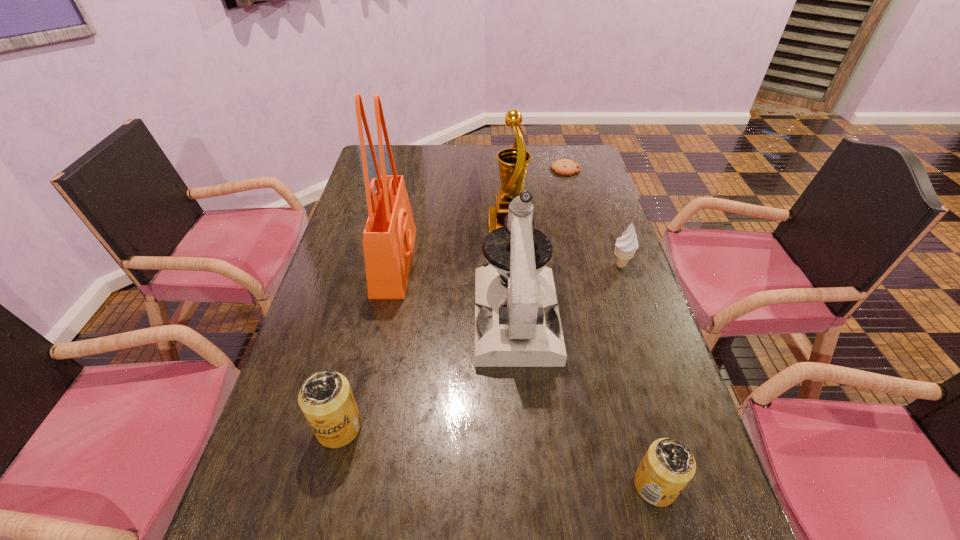
Where is `spot to insert another beer_can for uniform distribution`? spot to insert another beer_can for uniform distribution is located at coordinates (490, 455).